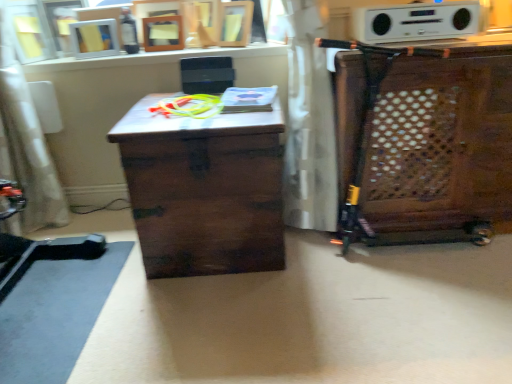
This screenshot has width=512, height=384. I want to click on free spot in front of white matte picture frame at upper left, so click(90, 59).